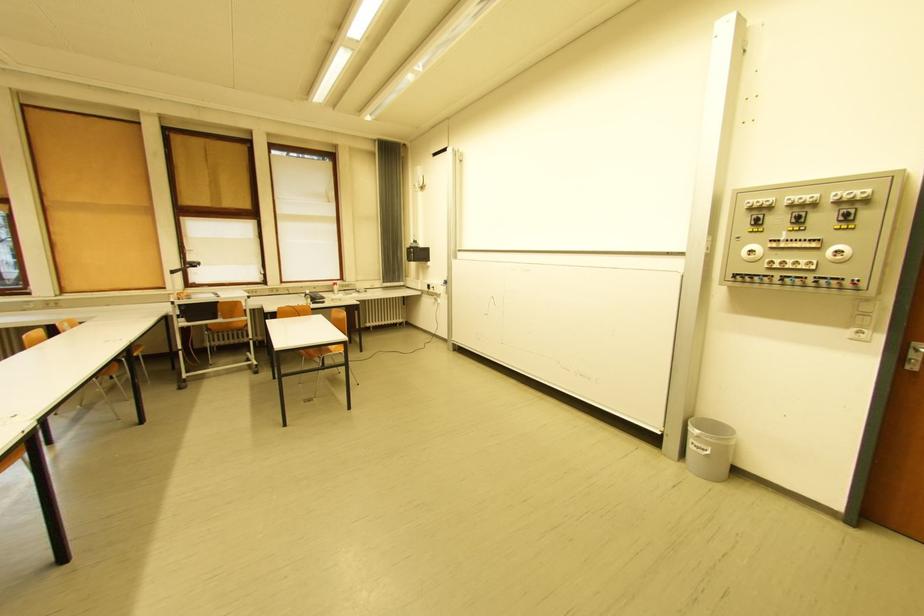
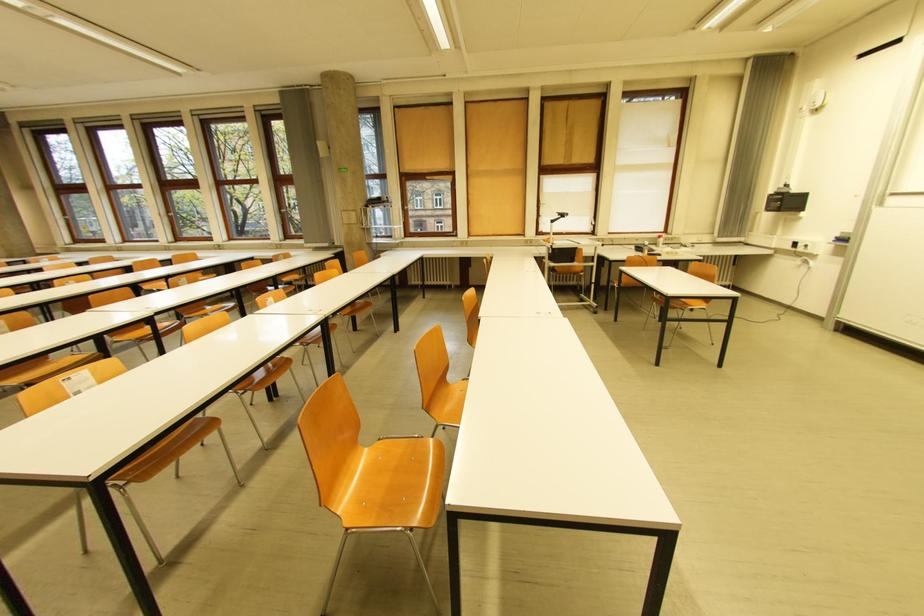
Locate, in the second image, the point that corresponds to the point at 335,204 in the first image.

(676, 148)